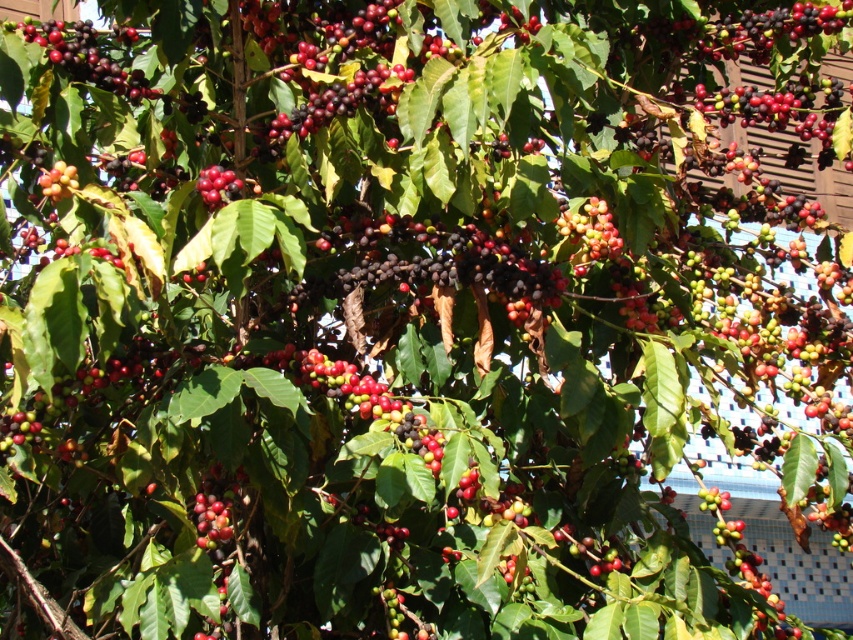
You are standing in front of the coffee tree and want to pick the cherries. There are two points marked on the tree where cherries are located. The first point is at coordinates point (212,180) and the second is at point (55,195). Which point is closer to you?

Point (55,195) is closer to you because it is in front of point (212,180).

In the scene of the coffee tree with shiny dark red berries at upper left and glossy red berry at upper left, which one is positioned more to the left?

The shiny dark red berries at upper left are positioned more to the left than the glossy red berry at upper left.